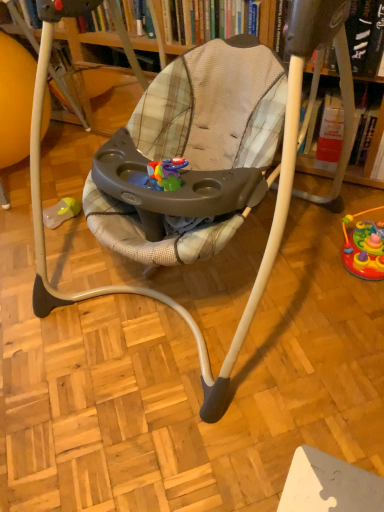
Question: Looking at their shapes, would you say hardcover book at upper center, the 2th book from the right, is wider or thinner than rubberized plastic toy at lower right?

Choices:
 (A) thin
 (B) wide

Answer: (B)

Question: In terms of size, does hardcover book at upper center, the 2th book from the right, appear bigger or smaller than rubberized plastic toy at lower right?

Choices:
 (A) small
 (B) big

Answer: (B)

Question: Which object is positioned farthest from the hardcover book at upper center, the first book viewed from the right?

Choices:
 (A) plaid fabric baby swing at center
 (B) rubberized plastic toy at lower right
 (C) hardcover book at upper center, the 2th book from the right

Answer: (A)

Question: Which of these objects is positioned farthest from the plaid fabric baby swing at center?

Choices:
 (A) rubberized plastic toy at lower right
 (B) hardcover book at upper center, the first book viewed from the right
 (C) hardcover book at upper center, the 2th book from the right

Answer: (A)